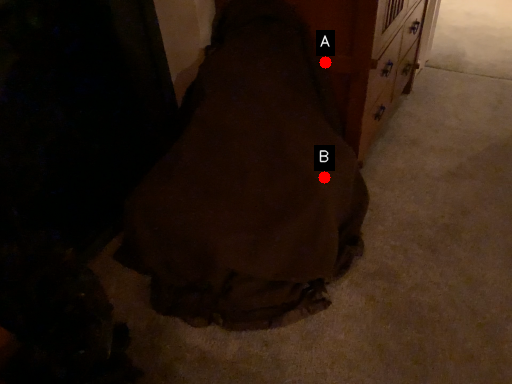
Question: Two points are circled on the image, labeled by A and B beside each circle. Among these points, which one is nearest to the camera?

Choices:
 (A) A is closer
 (B) B is closer

Answer: (B)